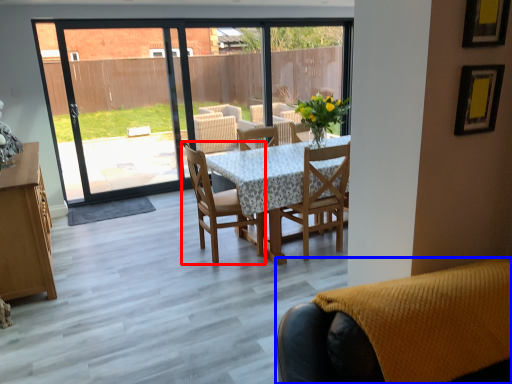
Question: Which of the following is the farthest to the observer, chair (highlighted by a red box) or chair (highlighted by a blue box)?

Choices:
 (A) chair
 (B) chair

Answer: (A)